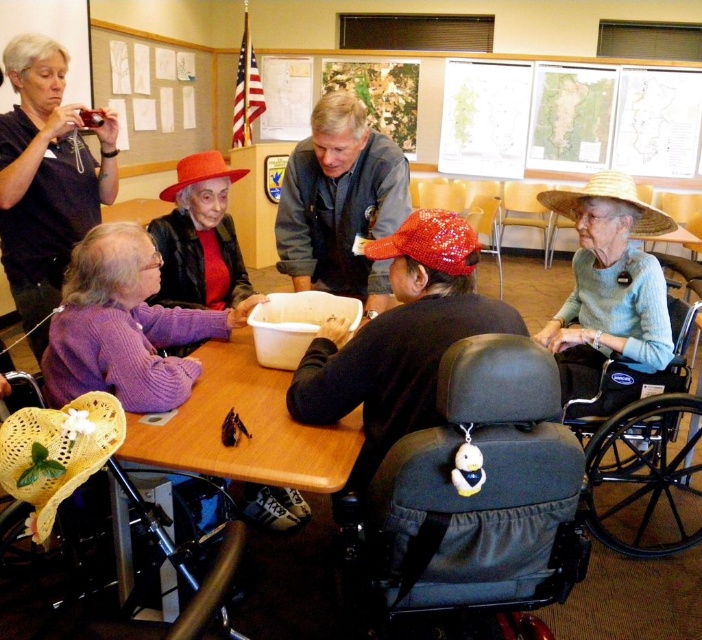
You are a photographer positioned at the lower left corner of the room. You want to take a photo of the light blue knitted sweater at center right and the black plastic wheelchair at lower right. Which object should you adjust your camera to focus on first if you want to capture both in the frame without moving your position?

You should focus on the light blue knitted sweater at center right first because it is closer to you than the black plastic wheelchair at lower right, allowing both to be captured in the frame without moving.

You are organizing a photography session in the community center. You need to position a tripod between the black fabric wheelchair at center and the black fabric camera at upper left. Based on their positions, where should you place the tripod?

The black fabric wheelchair at center is to the right of the black fabric camera at upper left, so the tripod should be placed between them, to the right of the camera and left of the wheelchair.